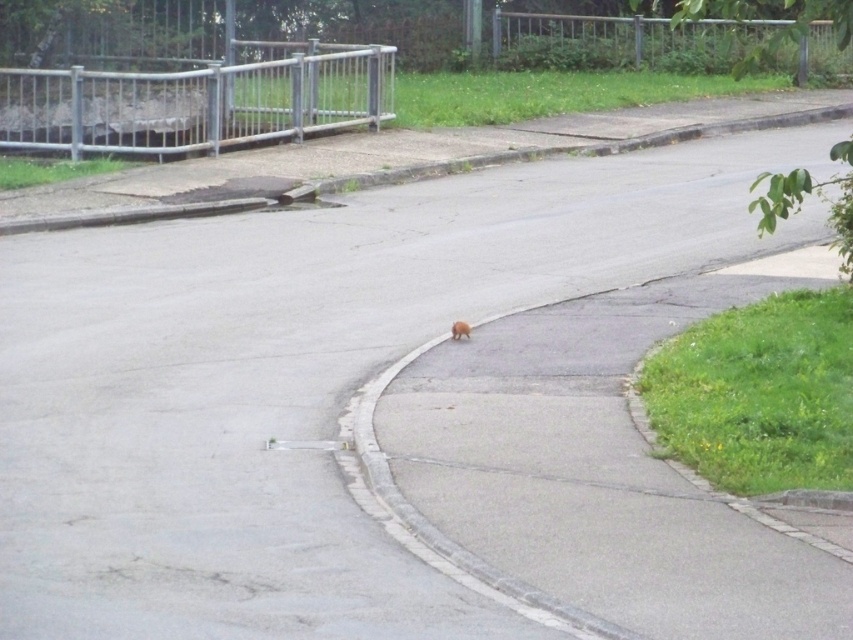
Between gray concrete curb at upper center and brown furry dog at center, which one is positioned lower?

Positioned lower is brown furry dog at center.

Is gray concrete curb at upper center further to the viewer compared to brown furry dog at center?

Yes, gray concrete curb at upper center is further from the viewer.

Which is in front, point (241, 170) or point (462, 323)?

Point (462, 323)

Find the location of a particular element. gray concrete curb at upper center is located at coordinates (386, 161).

How distant is brushed metal fence at upper left from brown furry dog at center?

brushed metal fence at upper left and brown furry dog at center are 32.11 feet apart.

Is point (144, 81) closer to camera compared to point (461, 332)?

That is False.

Who is more forward, (x=125, y=132) or (x=456, y=326)?

Positioned in front is point (x=456, y=326).

At what (x,y) coordinates should I click in order to perform the action: click on brushed metal fence at upper left. Please return your answer as a coordinate pair (x, y). This screenshot has width=853, height=640. Looking at the image, I should click on (196, 100).

Does gray concrete curb at upper center appear under brushed metal fence at upper left?

Yes.

Is point (167, 218) behind point (323, 122)?

No.

Find the location of `gray concrete curb at upper center`. gray concrete curb at upper center is located at coordinates (386, 161).